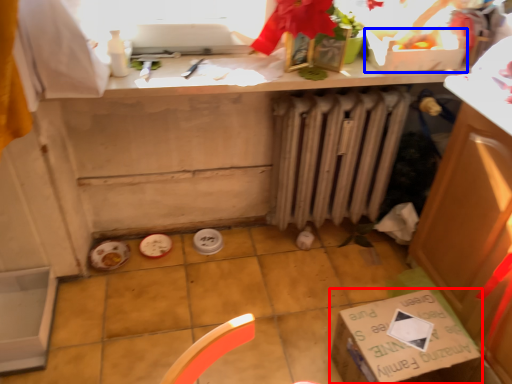
Question: Which object appears farthest to the camera in this image, cardboard box (highlighted by a red box) or box (highlighted by a blue box)?

Choices:
 (A) cardboard box
 (B) box

Answer: (B)